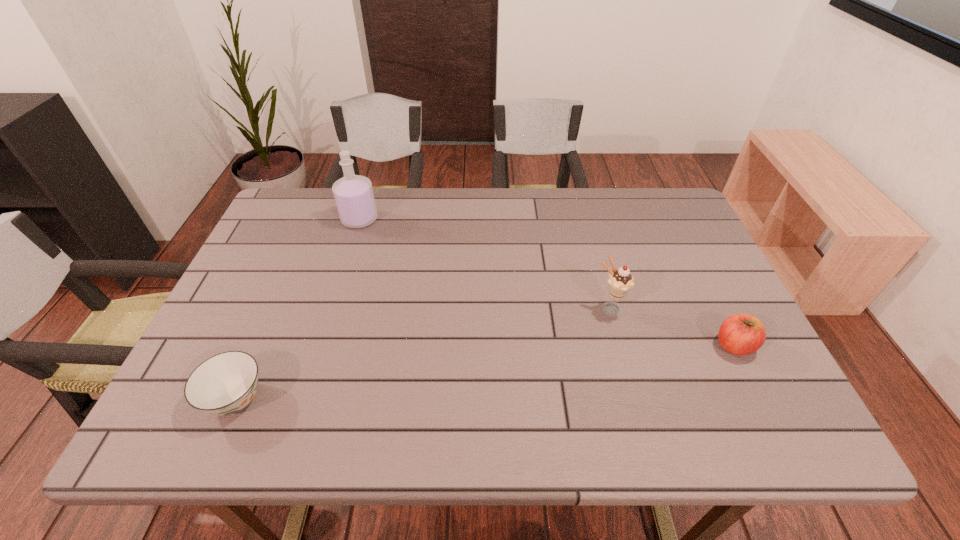
I want to click on the farthest object, so click(353, 194).

This screenshot has width=960, height=540. I want to click on the tallest object, so click(x=353, y=194).

This screenshot has height=540, width=960. Find the location of `the second tallest object`. the second tallest object is located at coordinates tap(620, 281).

This screenshot has width=960, height=540. Identify the location of the third nearest object. (620, 281).

Locate an element on the screen. the second shortest object is located at coordinates click(x=740, y=334).

Find the location of a particular element. the rightmost object is located at coordinates (740, 334).

This screenshot has height=540, width=960. I want to click on soup bowl, so point(224,384).

This screenshot has width=960, height=540. I want to click on the leftmost object, so click(224, 384).

Find the location of a particular element. free spot located on the right of the farthest object is located at coordinates (401, 219).

Locate an element on the screen. blank space located 0.270m on the front of the second tallest object is located at coordinates (641, 427).